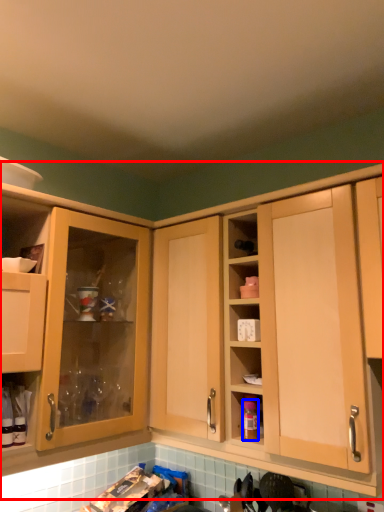
Question: Which object is closer to the camera taking this photo, cabinetry (highlighted by a red box) or bottle (highlighted by a blue box)?

Choices:
 (A) cabinetry
 (B) bottle

Answer: (A)